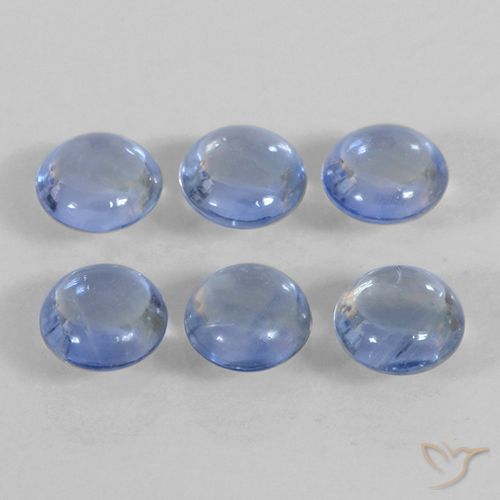
Identify the location of white surface. (251, 409).